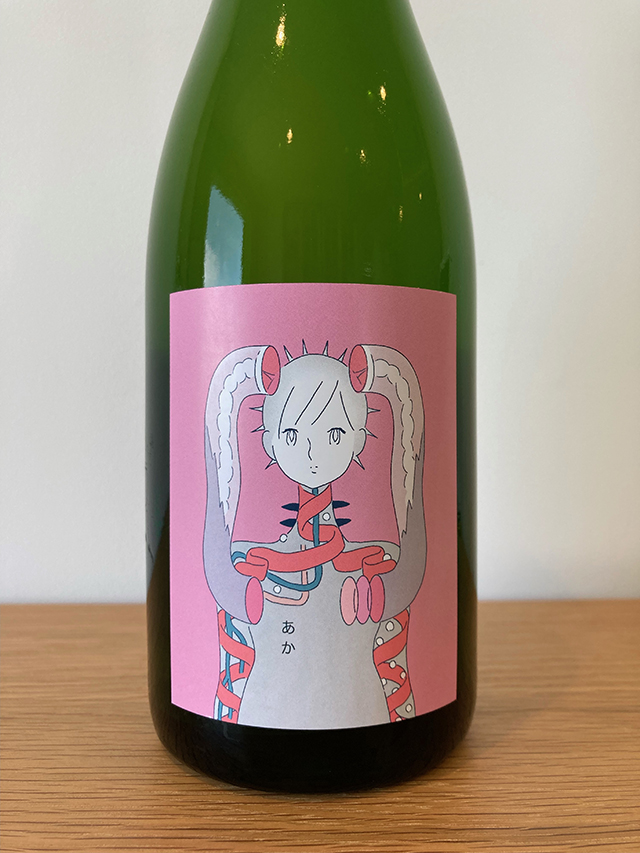
At what (x,y) coordinates should I click in order to perform the action: click on white wall. Please return your answer as a coordinate pair (x, y). The height and width of the screenshot is (853, 640). Looking at the image, I should click on (532, 378).